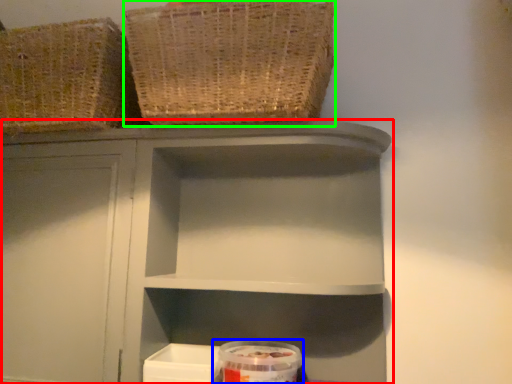
Question: Which is nearer to the shelf (highlighted by a red box)? glass jar (highlighted by a blue box) or basket (highlighted by a green box).

Choices:
 (A) glass jar
 (B) basket

Answer: (B)